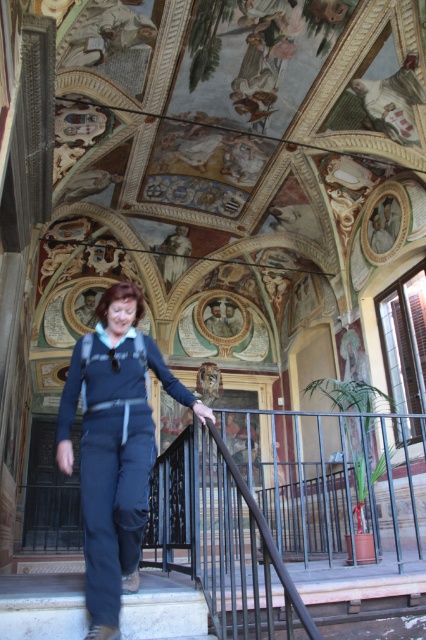
Can you confirm if dark blue fabric pants at lower left is taller than white marble stairs at lower left?

Indeed, dark blue fabric pants at lower left has a greater height compared to white marble stairs at lower left.

Is dark blue fabric pants at lower left above white marble stairs at lower left?

Yes, dark blue fabric pants at lower left is above white marble stairs at lower left.

Is point (140, 340) farther from camera compared to point (207, 611)?

Yes.

Image resolution: width=426 pixels, height=640 pixels. In order to click on dark blue fabric pants at lower left in this screenshot , I will do pyautogui.click(x=115, y=445).